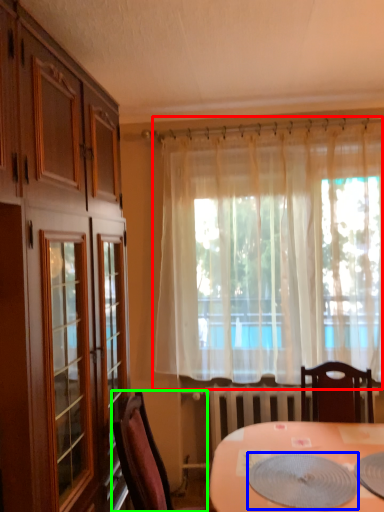
Question: Which is farther away from curtain (highlighted by a red box)? platter (highlighted by a blue box) or chair (highlighted by a green box)?

Choices:
 (A) platter
 (B) chair

Answer: (B)